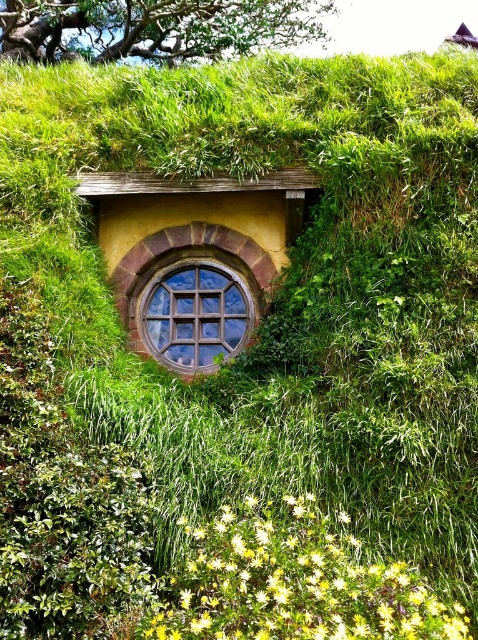
You are a gardener planning to plant a new row of flowers between the green leafy hedge at lower left and the yellow matte flower at lower center. Which object should you place the flowers closer to to ensure they have enough space to grow?

You should place the flowers closer to the yellow matte flower at lower center because the green leafy hedge at lower left has a smaller width, meaning there is less space available there compared to the area near the yellow matte flower at lower center.

You are standing in front of the hobbit house and want to plant a new flower bed. The flower bed requires a space that is at least 15 feet away from the green leafy hedge at lower left. Is the current distance sufficient?

The green leafy hedge at lower left is 14.67 feet away from the viewer. Since the required distance is 15 feet, the current distance is insufficient for the flower bed.

You are a painter who wants to paint the wooden window at center and the wooden grid window at center. However, you can only paint one of them due to limited time. Which one should you paint first if you want to paint the one that is more visible in the scene?

You should paint the wooden window at center first because it is in front of the wooden grid window at center, making it more visible.